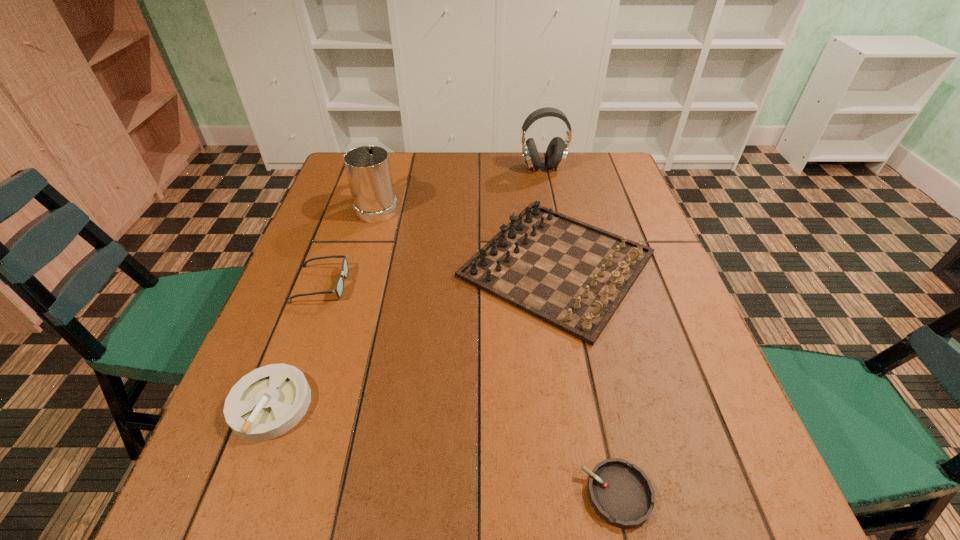
I want to click on headset, so click(556, 153).

Where is `mug`? This screenshot has height=540, width=960. mug is located at coordinates (368, 170).

The height and width of the screenshot is (540, 960). In order to click on the third tallest object in this screenshot , I will do `click(572, 275)`.

What are the coordinates of `spectacles` in the screenshot? It's located at (339, 287).

This screenshot has height=540, width=960. Find the location of `the fifth farthest object`. the fifth farthest object is located at coordinates (266, 403).

You are a GUI agent. You are given a task and a screenshot of the screen. Output one action in this format:
    pyautogui.click(x=<x>, y=<y>)
    Task: Click on the left ashtray
    Image resolution: width=960 pixels, height=540 pixels.
    Given the screenshot: What is the action you would take?
    pyautogui.click(x=266, y=403)

The height and width of the screenshot is (540, 960). In order to click on the nearest object in this screenshot , I will do `click(621, 494)`.

Where is `the shorter ashtray`? the shorter ashtray is located at coordinates (621, 494).

The width and height of the screenshot is (960, 540). In order to click on free region located 0.160m on the ear cups of the farthest object in this screenshot , I will do `click(550, 205)`.

The height and width of the screenshot is (540, 960). I want to click on free location located on the side of the mug with the handle, so click(x=391, y=161).